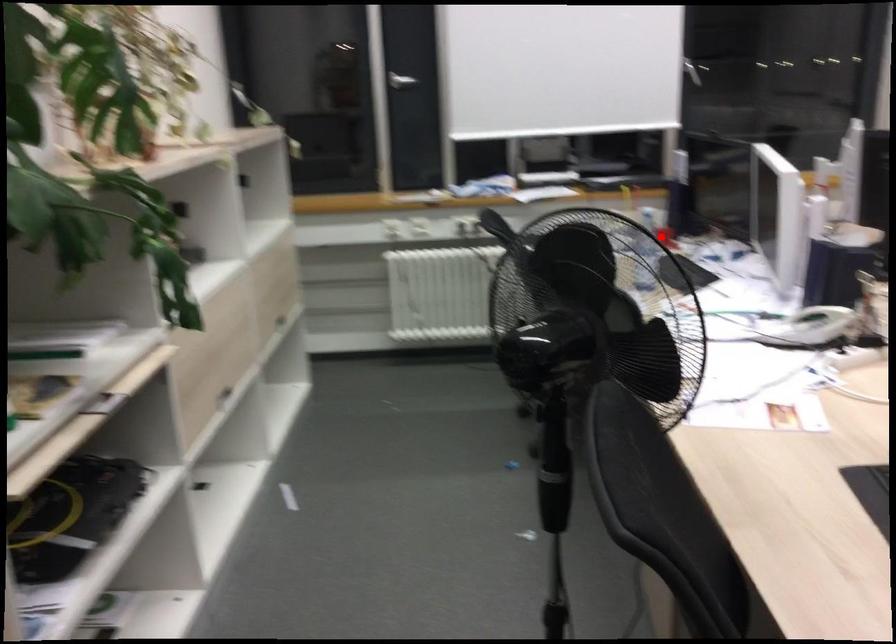
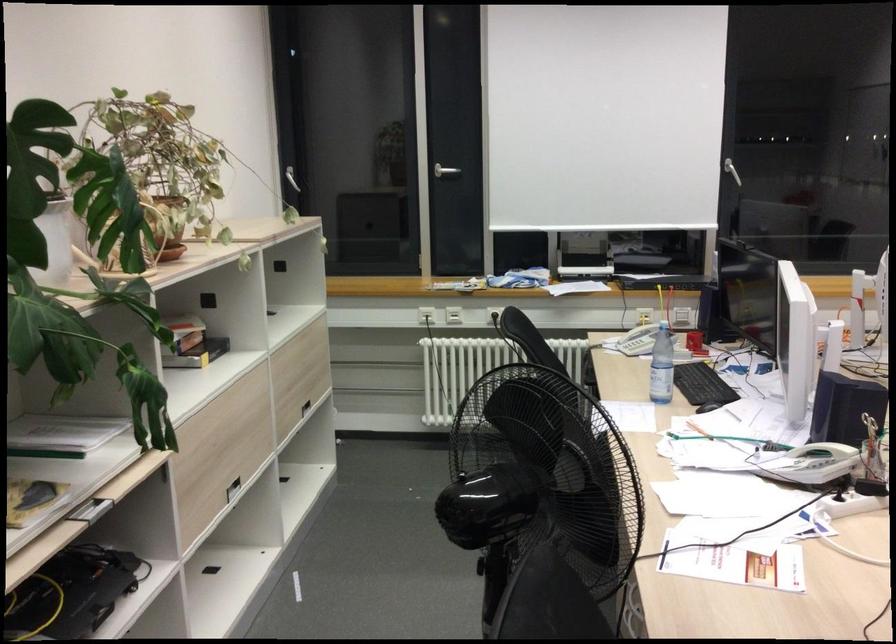
Question: I am providing you with two images of the same scene from different viewpoints. A red point is marked on the first image. Can you still see the location of the red point in image 2?

Choices:
 (A) Yes
 (B) No

Answer: (A)